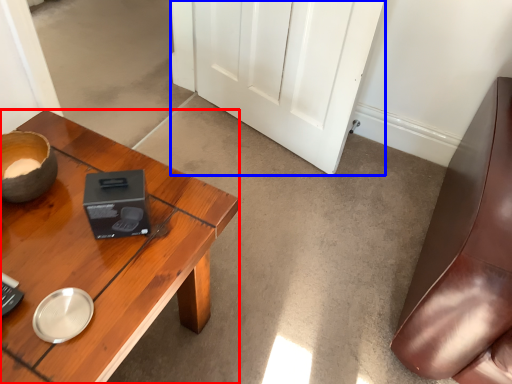
Question: Among these objects, which one is nearest to the camera, desk (highlighted by a red box) or door (highlighted by a blue box)?

Choices:
 (A) desk
 (B) door

Answer: (A)